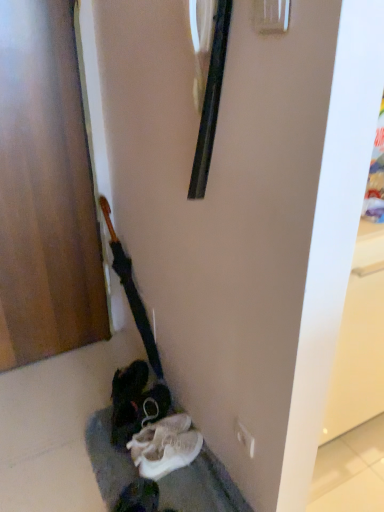
Question: Is white fabric shoe at lower center a part of wooden polished guitar at left?

Choices:
 (A) no
 (B) yes

Answer: (A)

Question: Does wooden polished guitar at left appear on the right side of white fabric shoe at lower center?

Choices:
 (A) no
 (B) yes

Answer: (A)

Question: Is wooden polished guitar at left positioned in front of white fabric shoe at lower center?

Choices:
 (A) no
 (B) yes

Answer: (A)

Question: Considering the relative positions of wooden polished guitar at left and white fabric shoe at lower center in the image provided, is wooden polished guitar at left to the left of white fabric shoe at lower center from the viewer's perspective?

Choices:
 (A) no
 (B) yes

Answer: (B)

Question: Considering the relative sizes of wooden polished guitar at left and white fabric shoe at lower center in the image provided, is wooden polished guitar at left wider than white fabric shoe at lower center?

Choices:
 (A) yes
 (B) no

Answer: (B)

Question: Is wooden polished guitar at left bigger than white fabric shoe at lower center?

Choices:
 (A) yes
 (B) no

Answer: (A)

Question: Considering the relative sizes of wooden polished guitar at left and wooden door at left in the image provided, is wooden polished guitar at left thinner than wooden door at left?

Choices:
 (A) no
 (B) yes

Answer: (A)

Question: Does wooden polished guitar at left appear on the left side of wooden door at left?

Choices:
 (A) no
 (B) yes

Answer: (A)

Question: Is the position of wooden polished guitar at left less distant than that of wooden door at left?

Choices:
 (A) no
 (B) yes

Answer: (A)

Question: Does wooden polished guitar at left have a larger size compared to wooden door at left?

Choices:
 (A) yes
 (B) no

Answer: (B)

Question: Considering the relative sizes of wooden polished guitar at left and wooden door at left in the image provided, is wooden polished guitar at left shorter than wooden door at left?

Choices:
 (A) no
 (B) yes

Answer: (B)

Question: From the image's perspective, is wooden polished guitar at left over wooden door at left?

Choices:
 (A) yes
 (B) no

Answer: (B)

Question: Would you say wooden door at left contains white fabric shoe at lower center?

Choices:
 (A) no
 (B) yes

Answer: (A)